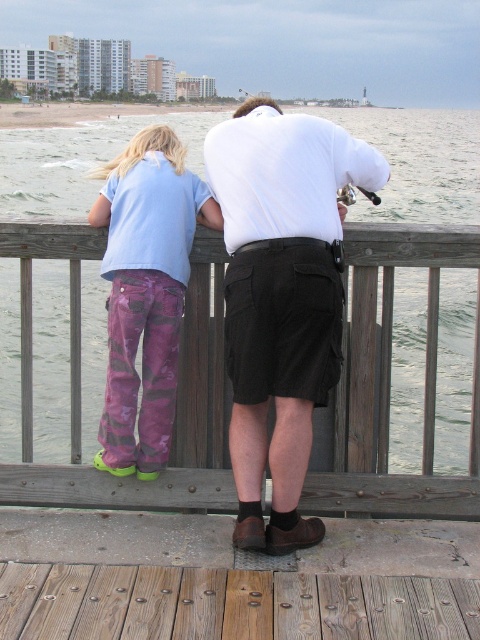
You are a photographer trying to capture a photo of the two people on the pier. You want to ensure that both the light blue cotton shirt at center and the camouflage pants at left are clearly visible in the frame. Based on their positions, which object should you focus on first to ensure both are in focus?

Since the light blue cotton shirt at center is to the right of the camouflage pants at left, you should focus on the camouflage pants at left first. This way, the distance between the two objects will be accounted for, ensuring both are in focus when using a camera with a fixed focal point.

You are standing on the wooden pier and want to lean against the wooden rail at center. Based on the coordinates provided, can you reach the point at point (391, 342)?

Yes, the point (391, 342) is on the wooden rail at center, so you can reach it while leaning against the wooden rail at center.

You are a maintenance worker on the pier. You need to replace a damaged section of the wooden rail at center and the wooden planks at lower center. Which object requires a larger replacement piece?

The wooden rail at center requires a larger replacement piece because it is larger in size than the wooden planks at lower center.